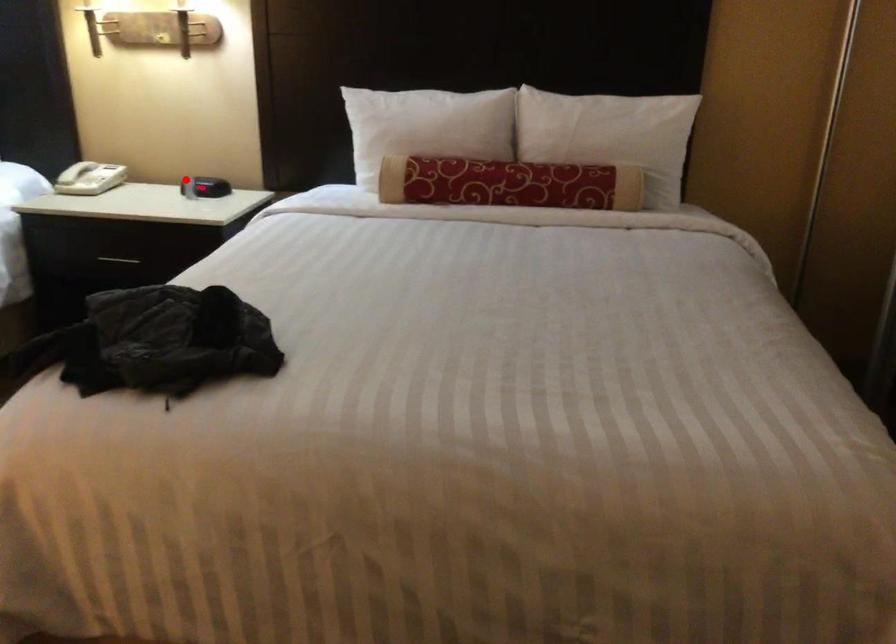
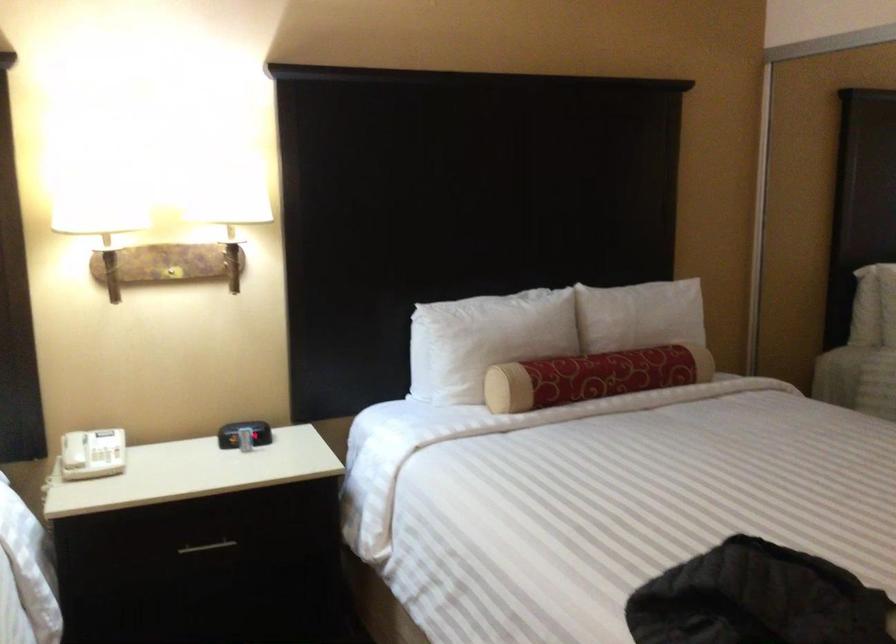
Question: A red point is marked in image1. In image2, is the corresponding 3D point closer to the camera or farther? Reply with the corresponding letter.

Choices:
 (A) The corresponding 3D point is closer.
 (B) The corresponding 3D point is farther.

Answer: (A)